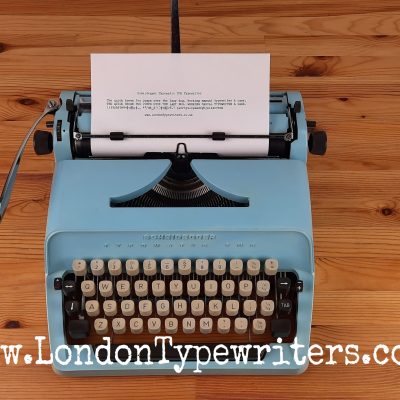
Locate an element on the screen. empty space right of typewriter is located at coordinates (345, 259).